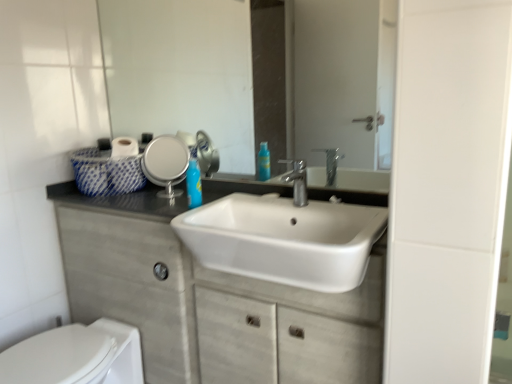
The image size is (512, 384). Identify the location of white glossy sink at center. (285, 238).

The image size is (512, 384). Describe the element at coordinates (193, 184) in the screenshot. I see `blue glossy soap dispenser at center` at that location.

Locate an element on the screen. white matte cabinet at center is located at coordinates (210, 301).

Is white matte cabinet at center at the back of silver metallic faucet at center?

No, white matte cabinet at center is not at the back of silver metallic faucet at center.

Between point (302, 192) and point (183, 304), which one is positioned behind?

The point (183, 304) is farther from the camera.

Which object is further away from the camera, silver metallic faucet at center or white matte cabinet at center?

silver metallic faucet at center is further away from the camera.

Which of these two, silver metallic faucet at center or white matte cabinet at center, is smaller?

silver metallic faucet at center.

Is there a large distance between blue glossy soap dispenser at center and silver metallic faucet at center?

They are positioned close to each other.

Is blue glossy soap dispenser at center oriented towards silver metallic faucet at center?

No, blue glossy soap dispenser at center does not turn towards silver metallic faucet at center.

Is point (193, 186) positioned in front of point (297, 202)?

No, (193, 186) is behind (297, 202).

Considering the positions of point (204, 294) and point (199, 204), is point (204, 294) closer or farther from the camera than point (199, 204)?

Clearly, point (204, 294) is closer to the camera than point (199, 204).

Measure the distance between white matte cabinet at center and blue glossy soap dispenser at center.

The distance of white matte cabinet at center from blue glossy soap dispenser at center is 16.02 inches.

Locate an element on the screen. The width and height of the screenshot is (512, 384). soap dispenser above the white matte cabinet at center (from a real-world perspective) is located at coordinates (193, 184).

What's the angular difference between white matte cabinet at center and blue glossy soap dispenser at center's facing directions?

2.44 degrees separate the facing orientations of white matte cabinet at center and blue glossy soap dispenser at center.

Which of these two, clear glass mirror at upper center or white glossy toilet at lower left, is thinner?

clear glass mirror at upper center.

From a real-world perspective, is clear glass mirror at upper center physically below white glossy toilet at lower left?

No, from a real-world perspective, clear glass mirror at upper center is not beneath white glossy toilet at lower left.

Is white glossy toilet at lower left surrounded by clear glass mirror at upper center?

No, white glossy toilet at lower left is not surrounded by clear glass mirror at upper center.

Visually, is white glossy sink at center positioned to the left or to the right of blue glossy soap dispenser at center?

From the image, it's evident that white glossy sink at center is to the right of blue glossy soap dispenser at center.

Which object is wider, white glossy sink at center or blue glossy soap dispenser at center?

white glossy sink at center.

Is white glossy sink at center with blue glossy soap dispenser at center?

There is a gap between white glossy sink at center and blue glossy soap dispenser at center.

Consider the image. Can you tell me how much white glossy sink at center and blue glossy soap dispenser at center differ in facing direction?

white glossy sink at center and blue glossy soap dispenser at center are facing 1.55 degrees away from each other.

Looking at this image, could you tell me if blue glossy soap dispenser at center is turned towards white matte cabinet at center?

No, blue glossy soap dispenser at center is not oriented towards white matte cabinet at center.

From a real-world perspective, which object stands above the other?

In real-world perspective, blue glossy soap dispenser at center is above.

Find the location of a particular element. The image size is (512, 384). bathroom cabinet below the blue glossy soap dispenser at center (from the image's perspective) is located at coordinates (210, 301).

Considering the relative positions of white glossy toilet at lower left and white glossy sink at center in the image provided, is white glossy toilet at lower left to the left of white glossy sink at center from the viewer's perspective?

Yes.

Is the surface of white glossy toilet at lower left in direct contact with white glossy sink at center?

There is a gap between white glossy toilet at lower left and white glossy sink at center.

In the scene shown: Is white glossy toilet at lower left aimed at white glossy sink at center?

A: No, white glossy toilet at lower left is not aimed at white glossy sink at center.

Which is closer to the camera, [138,347] or [230,246]?

The point [230,246] is closer to the camera.

At what (x,y) coordinates should I click in order to perform the action: click on tap to the right of white matte cabinet at center. Please return your answer as a coordinate pair (x, y). The image size is (512, 384). Looking at the image, I should click on (297, 180).

Identify the location of soap dispenser behind the silver metallic faucet at center. This screenshot has width=512, height=384. (193, 184).

When comparing their distances from white glossy toilet at lower left, does white matte cabinet at center or clear glass mirror at upper center seem further?

Based on the image, clear glass mirror at upper center appears to be further to white glossy toilet at lower left.

When comparing their distances from white glossy sink at center, does clear glass mirror at upper center or white matte cabinet at center seem closer?

The object closer to white glossy sink at center is white matte cabinet at center.

Estimate the real-world distances between objects in this image. Which object is closer to white matte cabinet at center, white glossy sink at center or clear glass mirror at upper center?

Among the two, white glossy sink at center is located nearer to white matte cabinet at center.

From the image, which object appears to be farther from silver metallic faucet at center, blue glossy soap dispenser at center or white glossy sink at center?

Based on the image, blue glossy soap dispenser at center appears to be further to silver metallic faucet at center.

In the scene shown: Estimate the real-world distances between objects in this image. Which object is closer to silver metallic faucet at center, white glossy toilet at lower left or clear glass mirror at upper center?

The object closer to silver metallic faucet at center is white glossy toilet at lower left.

When comparing their distances from white matte cabinet at center, does blue glossy soap dispenser at center or white glossy toilet at lower left seem further?

Among the two, blue glossy soap dispenser at center is located further to white matte cabinet at center.

When comparing their distances from clear glass mirror at upper center, does blue glossy soap dispenser at center or silver metallic faucet at center seem closer?

silver metallic faucet at center is closer to clear glass mirror at upper center.

From the image, which object appears to be nearer to white glossy sink at center, white matte cabinet at center or white glossy toilet at lower left?

Among the two, white matte cabinet at center is located nearer to white glossy sink at center.

Image resolution: width=512 pixels, height=384 pixels. What are the coordinates of `tap between clear glass mirror at upper center and white matte cabinet at center vertically` in the screenshot? It's located at (297, 180).

Find the location of a particular element. The image size is (512, 384). sink between clear glass mirror at upper center and white glossy toilet at lower left vertically is located at coordinates (285, 238).

Image resolution: width=512 pixels, height=384 pixels. Find the location of `bathroom cabinet between white glossy toilet at lower left and white glossy sink at center from left to right`. bathroom cabinet between white glossy toilet at lower left and white glossy sink at center from left to right is located at coordinates (210, 301).

Find the location of a particular element. sink between blue glossy soap dispenser at center and white glossy toilet at lower left from top to bottom is located at coordinates (285, 238).